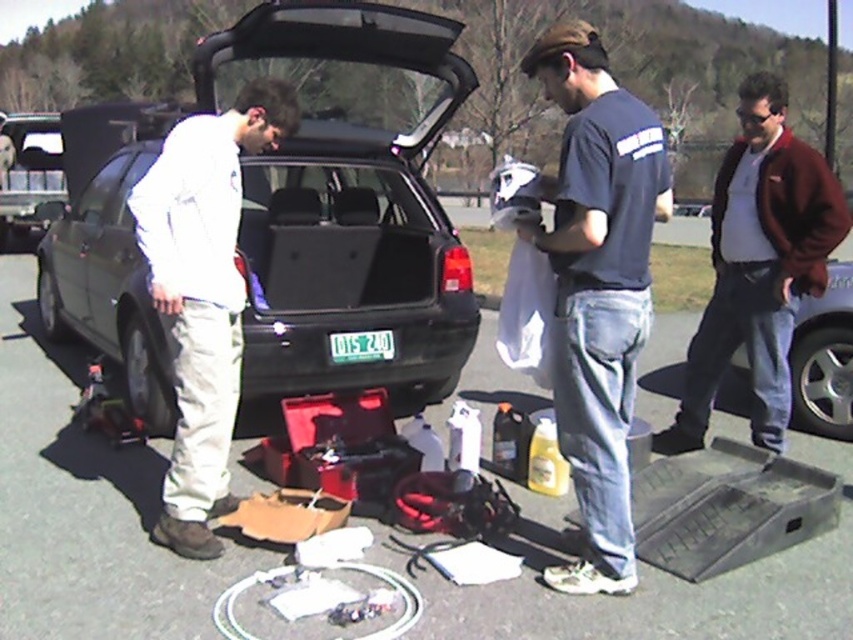
Is maroon woolen jacket at right smaller than metallic silver car at right?

Correct, maroon woolen jacket at right occupies less space than metallic silver car at right.

The height and width of the screenshot is (640, 853). I want to click on maroon woolen jacket at right, so click(x=759, y=266).

Identify the location of maroon woolen jacket at right. (759, 266).

Which is more to the right, dark blue t-shirt at center or metallic silver car at right?

metallic silver car at right is more to the right.

Measure the distance between dark blue t-shirt at center and camera.

dark blue t-shirt at center and camera are 2.89 meters apart.

The height and width of the screenshot is (640, 853). Identify the location of dark blue t-shirt at center. (596, 285).

Which of these two, matte black car at center or maroon woolen jacket at right, stands taller?

Standing taller between the two is matte black car at center.

Is matte black car at center to the left of maroon woolen jacket at right from the viewer's perspective?

Indeed, matte black car at center is positioned on the left side of maroon woolen jacket at right.

The width and height of the screenshot is (853, 640). Identify the location of matte black car at center. (347, 198).

The width and height of the screenshot is (853, 640). In order to click on matte black car at center in this screenshot , I will do `click(347, 198)`.